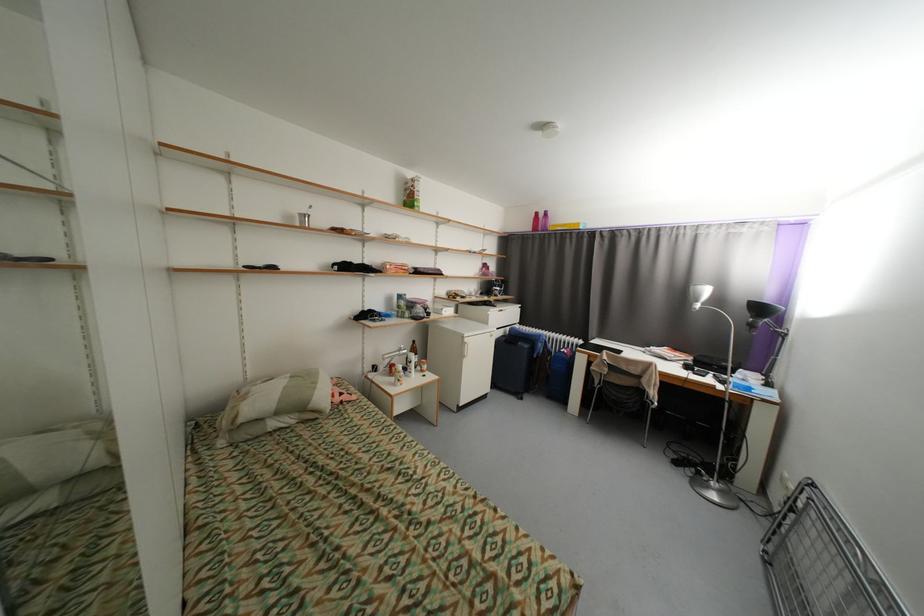
Find where to lift the silver cup. Please return your answer as a coordinate pair (x, y).

(304, 219)